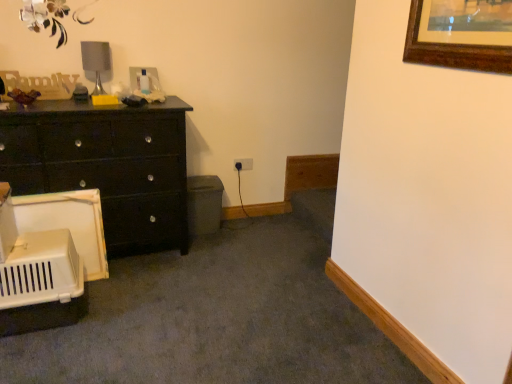
Question: From the image's perspective, is matte silver table lamp at upper left positioned above or below matte black dresser at left?

Choices:
 (A) below
 (B) above

Answer: (B)

Question: Which is correct: matte silver table lamp at upper left is inside matte black dresser at left, or outside of it?

Choices:
 (A) inside
 (B) outside

Answer: (B)

Question: From a real-world perspective, is matte silver table lamp at upper left physically located above or below matte black dresser at left?

Choices:
 (A) above
 (B) below

Answer: (A)

Question: Is point (0, 122) closer or farther from the camera than point (98, 74)?

Choices:
 (A) closer
 (B) farther

Answer: (A)

Question: From a real-world perspective, is matte black dresser at left above or below matte silver table lamp at upper left?

Choices:
 (A) below
 (B) above

Answer: (A)

Question: Considering the positions of matte black dresser at left and matte silver table lamp at upper left in the image, is matte black dresser at left wider or thinner than matte silver table lamp at upper left?

Choices:
 (A) thin
 (B) wide

Answer: (B)

Question: From the image's perspective, is matte black dresser at left located above or below matte silver table lamp at upper left?

Choices:
 (A) above
 (B) below

Answer: (B)